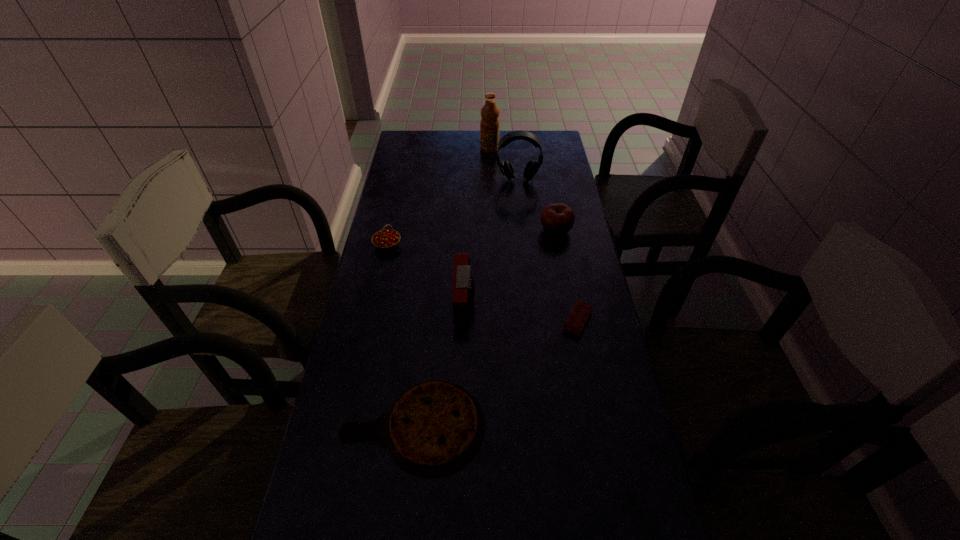
Where is `free space located on the label side of the fruit juice`? This screenshot has width=960, height=540. free space located on the label side of the fruit juice is located at coordinates (396, 148).

Locate an element on the screen. vacant space located on the label side of the fruit juice is located at coordinates (396, 148).

Locate an element on the screen. The height and width of the screenshot is (540, 960). free spot located on the ear cups of the sixth shortest object is located at coordinates (521, 212).

You are a GUI agent. You are given a task and a screenshot of the screen. Output one action in this format:
    pyautogui.click(x=<x>, y=<y>)
    Task: Click on the vacant space situated on the front-facing side of the camera
    The image size is (960, 540).
    Given the screenshot: What is the action you would take?
    pyautogui.click(x=495, y=301)

In order to click on free space located 0.060m on the back of the apple in this screenshot , I will do `click(552, 210)`.

Where is `free space located on the right of the fifth tallest object`? This screenshot has width=960, height=540. free space located on the right of the fifth tallest object is located at coordinates (466, 245).

Locate an element on the screen. Image resolution: width=960 pixels, height=540 pixels. vacant area located 0.240m on the right of the nearest object is located at coordinates (586, 426).

Image resolution: width=960 pixels, height=540 pixels. I want to click on vacant area situated 0.320m on the back of the Lego, so pyautogui.click(x=562, y=236).

Find the location of `object present at the far edge`. object present at the far edge is located at coordinates (489, 125).

Find the location of a particular element. This screenshot has width=960, height=540. strawberry positioned at the left edge is located at coordinates (386, 239).